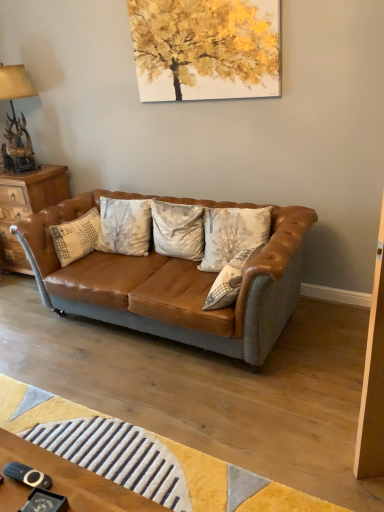
Locate an element on the screen. free spot to the right of yellow woolen mat at lower center is located at coordinates (265, 405).